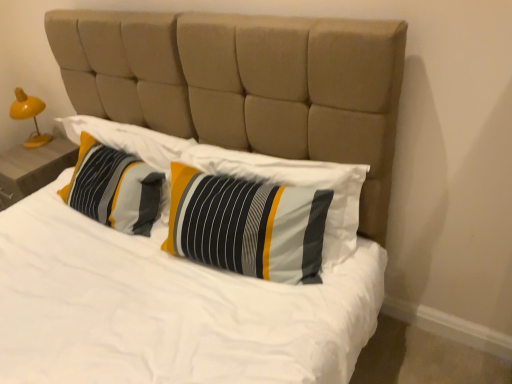
Question: Is striped fabric pillow at center, placed as the 1th pillow when sorted from right to left, placed right next to yellow wood nightstand at left?

Choices:
 (A) yes
 (B) no

Answer: (B)

Question: Does striped fabric pillow at center, placed as the 1th pillow when sorted from right to left, appear on the right side of yellow wood nightstand at left?

Choices:
 (A) no
 (B) yes

Answer: (B)

Question: From a real-world perspective, does striped fabric pillow at center, placed as the 1th pillow when sorted from right to left, stand above yellow wood nightstand at left?

Choices:
 (A) no
 (B) yes

Answer: (B)

Question: Is striped fabric pillow at center, the second pillow in the left-to-right sequence, positioned with its back to yellow wood nightstand at left?

Choices:
 (A) no
 (B) yes

Answer: (A)

Question: Considering the relative sizes of striped fabric pillow at center, placed as the 1th pillow when sorted from right to left, and yellow wood nightstand at left in the image provided, is striped fabric pillow at center, placed as the 1th pillow when sorted from right to left, smaller than yellow wood nightstand at left?

Choices:
 (A) yes
 (B) no

Answer: (A)

Question: Considering the positions of striped fabric pillow at center, the 1th pillow viewed from the left, and striped fabric pillow at center, placed as the 1th pillow when sorted from right to left, in the image, is striped fabric pillow at center, the 1th pillow viewed from the left, bigger or smaller than striped fabric pillow at center, placed as the 1th pillow when sorted from right to left,?

Choices:
 (A) big
 (B) small

Answer: (B)

Question: From the image's perspective, is striped fabric pillow at center, the 1th pillow viewed from the left, located above or below striped fabric pillow at center, placed as the 1th pillow when sorted from right to left?

Choices:
 (A) below
 (B) above

Answer: (B)

Question: Would you say striped fabric pillow at center, which ranks as the 2th pillow in right-to-left order, is to the left or to the right of striped fabric pillow at center, placed as the 1th pillow when sorted from right to left, in the picture?

Choices:
 (A) right
 (B) left

Answer: (B)

Question: Considering the positions of striped fabric pillow at center, which ranks as the 2th pillow in right-to-left order, and striped fabric pillow at center, placed as the 1th pillow when sorted from right to left, in the image, is striped fabric pillow at center, which ranks as the 2th pillow in right-to-left order, wider or thinner than striped fabric pillow at center, placed as the 1th pillow when sorted from right to left,?

Choices:
 (A) thin
 (B) wide

Answer: (B)

Question: From the image's perspective, relative to striped fabric pillow at center, which ranks as the 2th pillow in right-to-left order, is striped fabric pillow at center, the second pillow in the left-to-right sequence, above or below?

Choices:
 (A) above
 (B) below

Answer: (B)

Question: Is striped fabric pillow at center, placed as the 1th pillow when sorted from right to left, to the left or to the right of striped fabric pillow at center, the 1th pillow viewed from the left, in the image?

Choices:
 (A) right
 (B) left

Answer: (A)

Question: In terms of width, does striped fabric pillow at center, the second pillow in the left-to-right sequence, look wider or thinner when compared to striped fabric pillow at center, the 1th pillow viewed from the left?

Choices:
 (A) wide
 (B) thin

Answer: (B)

Question: Is striped fabric pillow at center, placed as the 1th pillow when sorted from right to left, bigger or smaller than striped fabric pillow at center, the 1th pillow viewed from the left?

Choices:
 (A) small
 (B) big

Answer: (B)

Question: Is yellow plastic lamp at left spatially inside striped fabric pillow at center, placed as the 1th pillow when sorted from right to left, or outside of it?

Choices:
 (A) inside
 (B) outside

Answer: (B)

Question: Relative to striped fabric pillow at center, the second pillow in the left-to-right sequence, is yellow plastic lamp at left in front or behind?

Choices:
 (A) behind
 (B) front

Answer: (A)